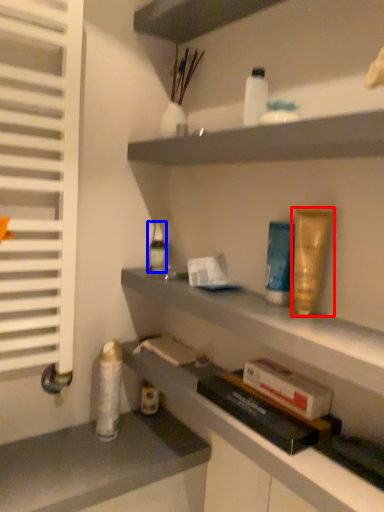
Question: Which of the following is the closest to the observer, toiletry (highlighted by a red box) or toiletry (highlighted by a blue box)?

Choices:
 (A) toiletry
 (B) toiletry

Answer: (A)